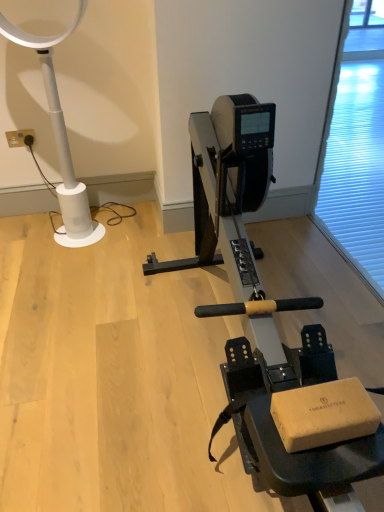
Where is `blank area to the left of metallic silver stationary bicycle at center`? The height and width of the screenshot is (512, 384). blank area to the left of metallic silver stationary bicycle at center is located at coordinates (81, 347).